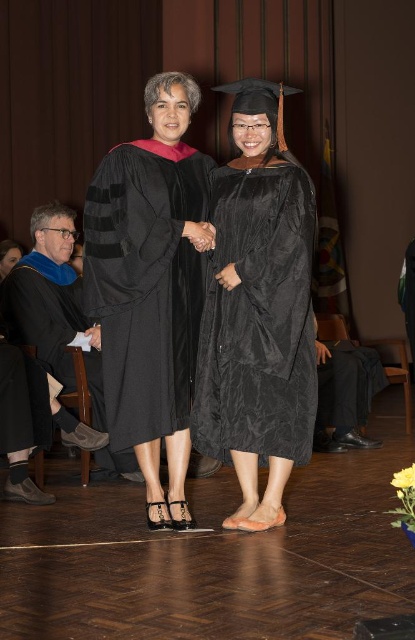
Who is shorter, matte black graduation gown at center or matte black gown at center?

Standing shorter between the two is matte black graduation gown at center.

Who is positioned more to the left, matte black graduation gown at center or matte black gown at center?

From the viewer's perspective, matte black gown at center appears more on the left side.

Who is more distant from viewer, (251, 136) or (190, 289)?

The point (190, 289) is behind.

Identify the location of matte black graduation gown at center. pyautogui.click(x=258, y=310).

Does matte black gown at center appear on the right side of matte black robe at left?

Yes, matte black gown at center is to the right of matte black robe at left.

Consider the image. Does matte black gown at center appear over matte black robe at left?

Yes, matte black gown at center is above matte black robe at left.

Where is `matte black gown at center`? matte black gown at center is located at coordinates (x=149, y=289).

Is matte black graduation gown at center to the left of matte black robe at left from the viewer's perspective?

No, matte black graduation gown at center is not to the left of matte black robe at left.

Does matte black graduation gown at center appear over matte black robe at left?

Correct, matte black graduation gown at center is located above matte black robe at left.

Does point (263, 248) come closer to viewer compared to point (85, 358)?

Yes.

At what (x,y) coordinates should I click in order to perform the action: click on matte black graduation gown at center. Please return your answer as a coordinate pair (x, y). Looking at the image, I should click on pyautogui.click(x=258, y=310).